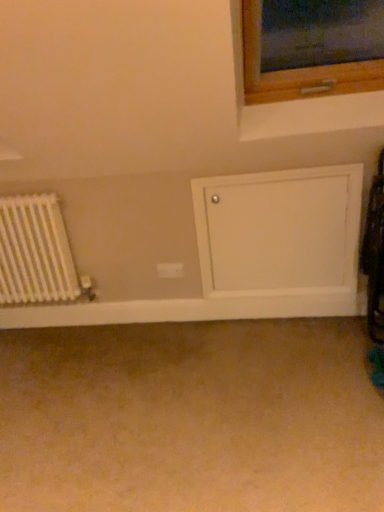
Question: Can you confirm if white matte radiator at left is positioned to the right of beige carpet at lower center?

Choices:
 (A) no
 (B) yes

Answer: (A)

Question: From a real-world perspective, is white matte radiator at left under beige carpet at lower center?

Choices:
 (A) no
 (B) yes

Answer: (A)

Question: Is white matte radiator at left at the left side of beige carpet at lower center?

Choices:
 (A) no
 (B) yes

Answer: (B)

Question: Is white matte radiator at left far away from beige carpet at lower center?

Choices:
 (A) no
 (B) yes

Answer: (A)

Question: From the image's perspective, would you say white matte radiator at left is positioned over beige carpet at lower center?

Choices:
 (A) yes
 (B) no

Answer: (A)

Question: From a real-world perspective, is beige carpet at lower center physically located above or below white plastic electric outlet at center?

Choices:
 (A) above
 (B) below

Answer: (B)

Question: Choose the correct answer: Is beige carpet at lower center inside white plastic electric outlet at center or outside it?

Choices:
 (A) inside
 (B) outside

Answer: (B)

Question: Considering the positions of point (117, 419) and point (172, 267), is point (117, 419) closer or farther from the camera than point (172, 267)?

Choices:
 (A) farther
 (B) closer

Answer: (B)

Question: Considering their positions, is beige carpet at lower center located in front of or behind white plastic electric outlet at center?

Choices:
 (A) front
 (B) behind

Answer: (A)

Question: From the image's perspective, is white painted wood door at lower right above or below beige carpet at lower center?

Choices:
 (A) above
 (B) below

Answer: (A)

Question: In the image, is white painted wood door at lower right positioned in front of or behind beige carpet at lower center?

Choices:
 (A) front
 (B) behind

Answer: (B)

Question: Based on their sizes in the image, would you say white painted wood door at lower right is bigger or smaller than beige carpet at lower center?

Choices:
 (A) big
 (B) small

Answer: (B)

Question: Based on their positions, is white painted wood door at lower right located to the left or right of beige carpet at lower center?

Choices:
 (A) left
 (B) right

Answer: (B)

Question: Is white plastic electric outlet at center to the left or to the right of beige carpet at lower center in the image?

Choices:
 (A) left
 (B) right

Answer: (B)

Question: Considering the positions of white plastic electric outlet at center and beige carpet at lower center in the image, is white plastic electric outlet at center wider or thinner than beige carpet at lower center?

Choices:
 (A) wide
 (B) thin

Answer: (B)